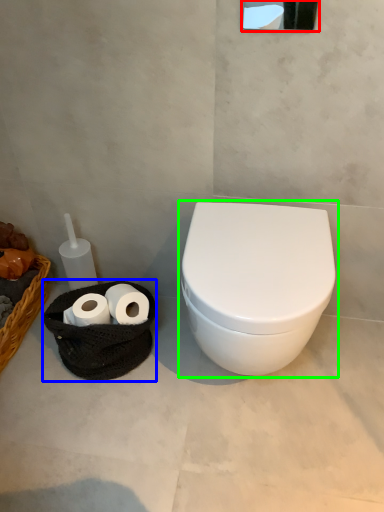
Question: Which object is the closest to the mirror (highlighted by a red box)? Choose among these: porcelain (highlighted by a blue box) or toilet (highlighted by a green box).

Choices:
 (A) porcelain
 (B) toilet

Answer: (B)